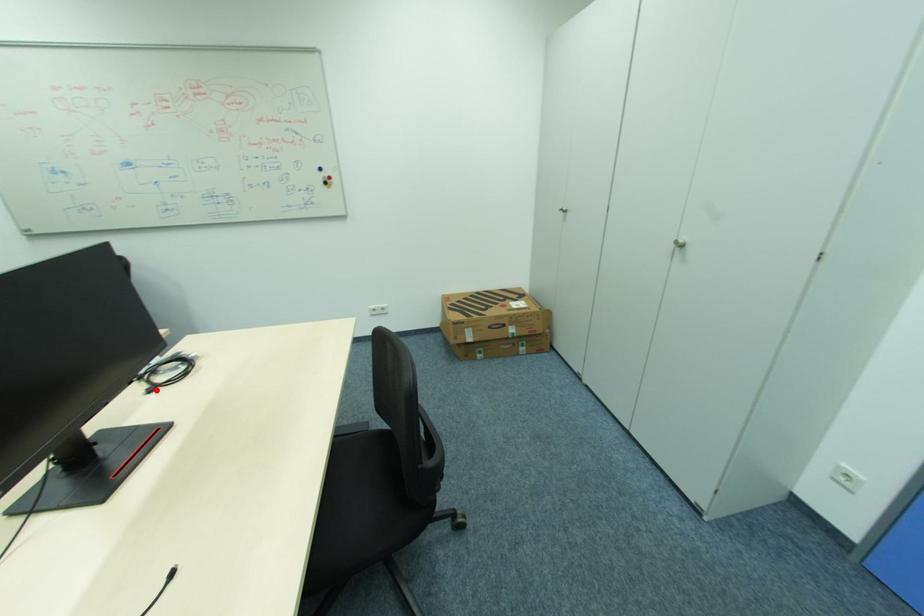
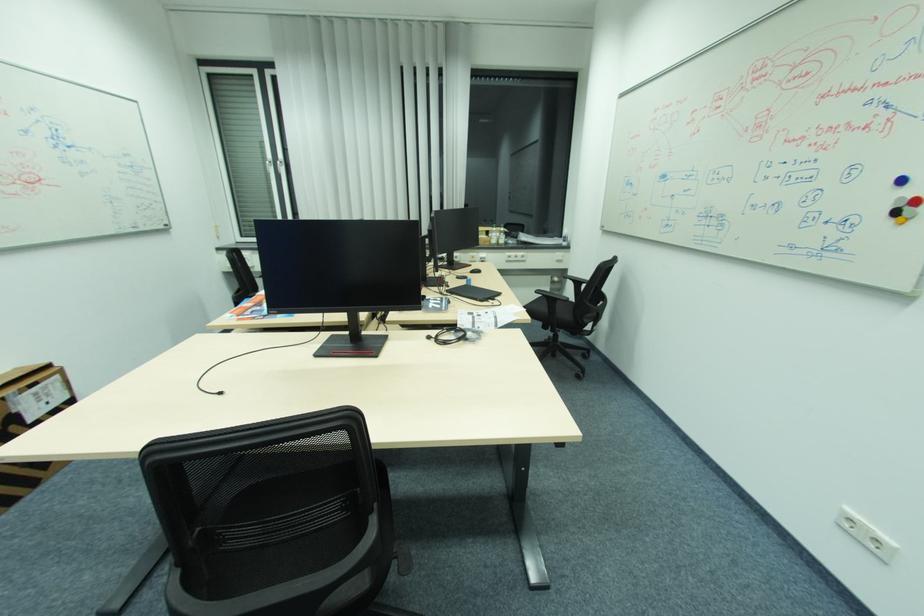
Locate, in the second image, the point that corresponds to the highlighted location in the first image.

(434, 338)